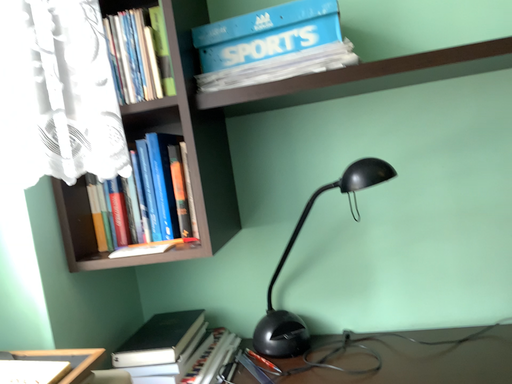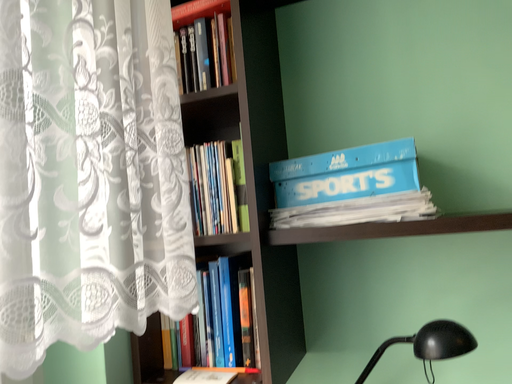
Question: Which way did the camera rotate in the video?

Choices:
 (A) rotated downward
 (B) rotated upward

Answer: (B)